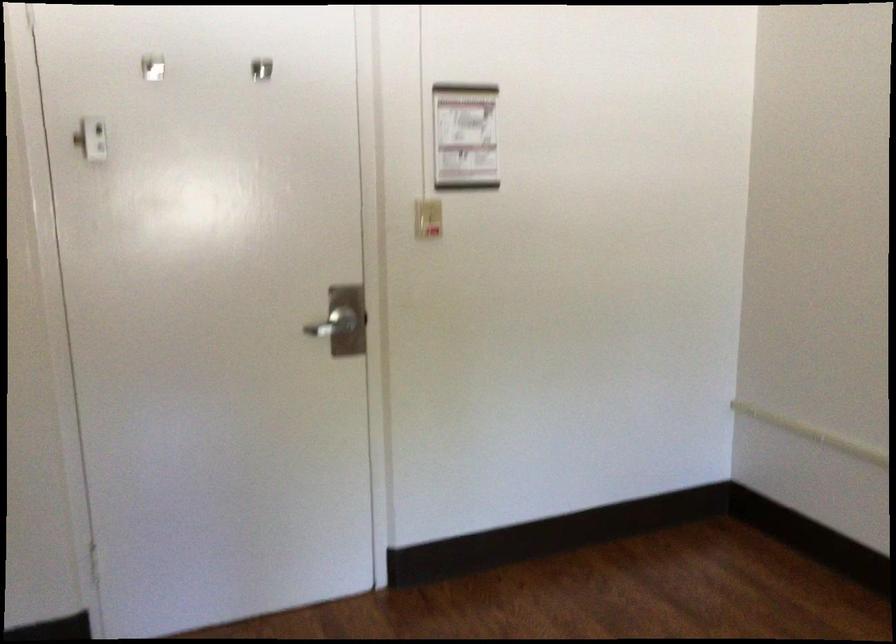
The height and width of the screenshot is (644, 896). Describe the element at coordinates (330, 323) in the screenshot. I see `the metal door handle` at that location.